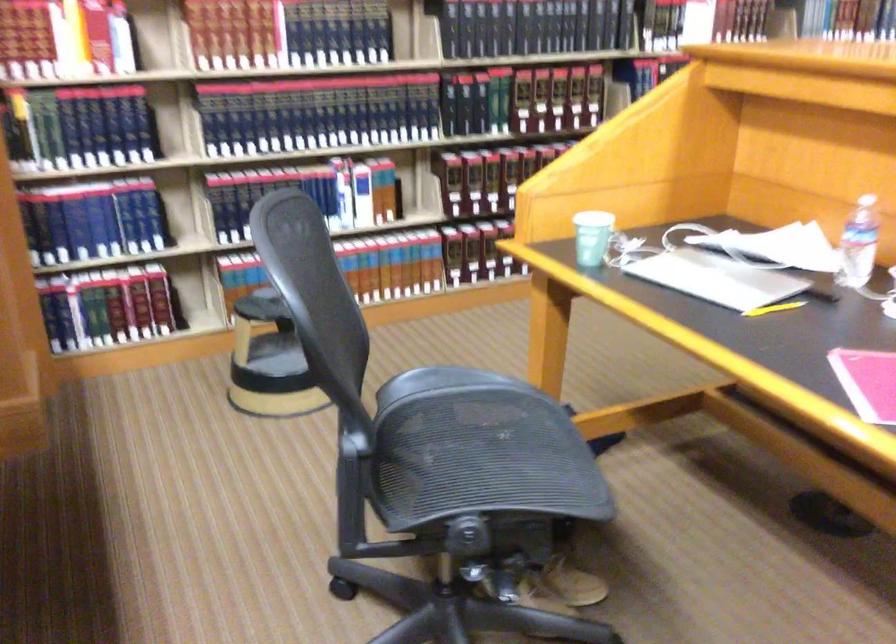
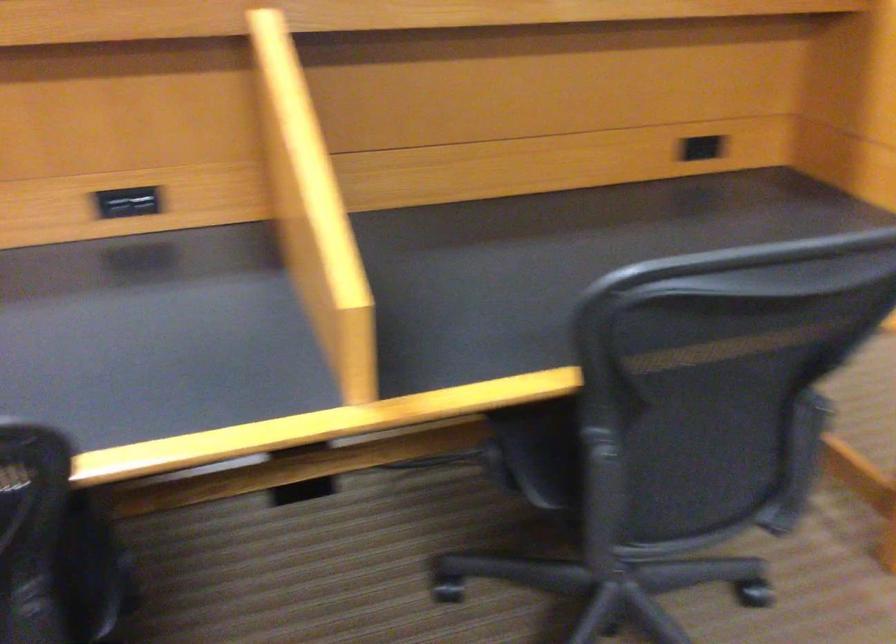
Question: I am providing you with two images of the same scene from different viewpoints. Please identify which objects are invisible in image2.

Choices:
 (A) chair armrest
 (B) black power outlet
 (C) chrome grab bar
 (D) plastic water bottle

Answer: (D)